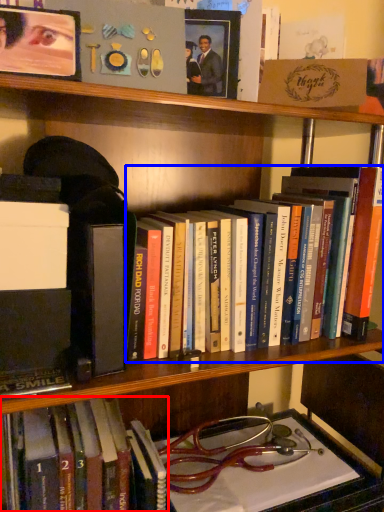
Question: Which object appears closest to the camera in this image, book (highlighted by a red box) or book (highlighted by a blue box)?

Choices:
 (A) book
 (B) book

Answer: (B)